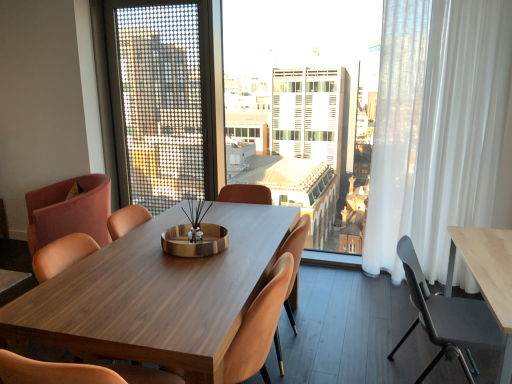
Question: Considering the relative sizes of pink fabric chair at left, the 1th chair positioned from the left, and wooden chair at center, the second chair viewed from the left, in the image provided, is pink fabric chair at left, the 1th chair positioned from the left, shorter than wooden chair at center, the second chair viewed from the left,?

Choices:
 (A) yes
 (B) no

Answer: (B)

Question: Is pink fabric chair at left, the 1th chair positioned from the left, not inside wooden chair at center, which is the 4th chair from right to left?

Choices:
 (A) yes
 (B) no

Answer: (A)

Question: Can you confirm if pink fabric chair at left, positioned as the fifth chair in right-to-left order, is thinner than wooden chair at center, which is the 4th chair from right to left?

Choices:
 (A) yes
 (B) no

Answer: (B)

Question: Considering the relative positions of pink fabric chair at left, positioned as the fifth chair in right-to-left order, and wooden chair at center, the second chair viewed from the left, in the image provided, is pink fabric chair at left, positioned as the fifth chair in right-to-left order, behind wooden chair at center, the second chair viewed from the left,?

Choices:
 (A) no
 (B) yes

Answer: (B)

Question: From a real-world perspective, does pink fabric chair at left, positioned as the fifth chair in right-to-left order, stand above wooden chair at center, which is the 4th chair from right to left?

Choices:
 (A) yes
 (B) no

Answer: (B)

Question: Is metallic gray chair at right, acting as the first chair starting from the right, taller or shorter than pink fabric chair at left, the 1th chair positioned from the left?

Choices:
 (A) short
 (B) tall

Answer: (A)

Question: In terms of width, does metallic gray chair at right, which is the fifth chair in left-to-right order, look wider or thinner when compared to pink fabric chair at left, the 1th chair positioned from the left?

Choices:
 (A) thin
 (B) wide

Answer: (A)

Question: From a real-world perspective, relative to pink fabric chair at left, positioned as the fifth chair in right-to-left order, is metallic gray chair at right, acting as the first chair starting from the right, vertically above or below?

Choices:
 (A) below
 (B) above

Answer: (A)

Question: In terms of size, does metallic gray chair at right, acting as the first chair starting from the right, appear bigger or smaller than pink fabric chair at left, the 1th chair positioned from the left?

Choices:
 (A) big
 (B) small

Answer: (B)

Question: Considering the positions of metallic gray chair at right, acting as the first chair starting from the right, and metallic mesh screen door at upper center in the image, is metallic gray chair at right, acting as the first chair starting from the right, bigger or smaller than metallic mesh screen door at upper center?

Choices:
 (A) big
 (B) small

Answer: (B)

Question: Does point (438, 332) appear closer or farther from the camera than point (196, 178)?

Choices:
 (A) farther
 (B) closer

Answer: (B)

Question: From a real-world perspective, is metallic gray chair at right, acting as the first chair starting from the right, physically located above or below metallic mesh screen door at upper center?

Choices:
 (A) above
 (B) below

Answer: (B)

Question: Considering their positions, is metallic gray chair at right, acting as the first chair starting from the right, located in front of or behind metallic mesh screen door at upper center?

Choices:
 (A) front
 (B) behind

Answer: (A)

Question: Choose the correct answer: Is transparent curtain at center inside wooden chair at center, the second chair viewed from the left, or outside it?

Choices:
 (A) inside
 (B) outside

Answer: (B)

Question: From the image's perspective, is transparent curtain at center positioned above or below wooden chair at center, which is the 4th chair from right to left?

Choices:
 (A) below
 (B) above

Answer: (B)